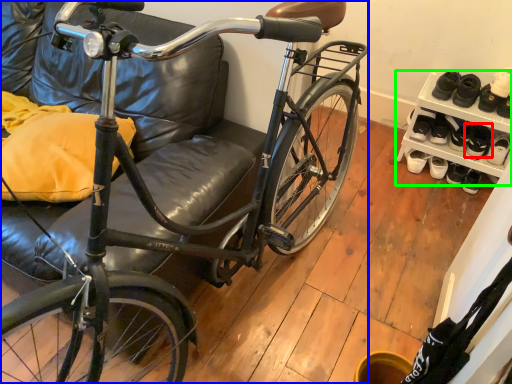
Question: Estimate the real-world distances between objects in this image. Which object is closer to footwear (highlighted by a red box), bicycle (highlighted by a blue box) or shelf (highlighted by a green box)?

Choices:
 (A) bicycle
 (B) shelf

Answer: (B)